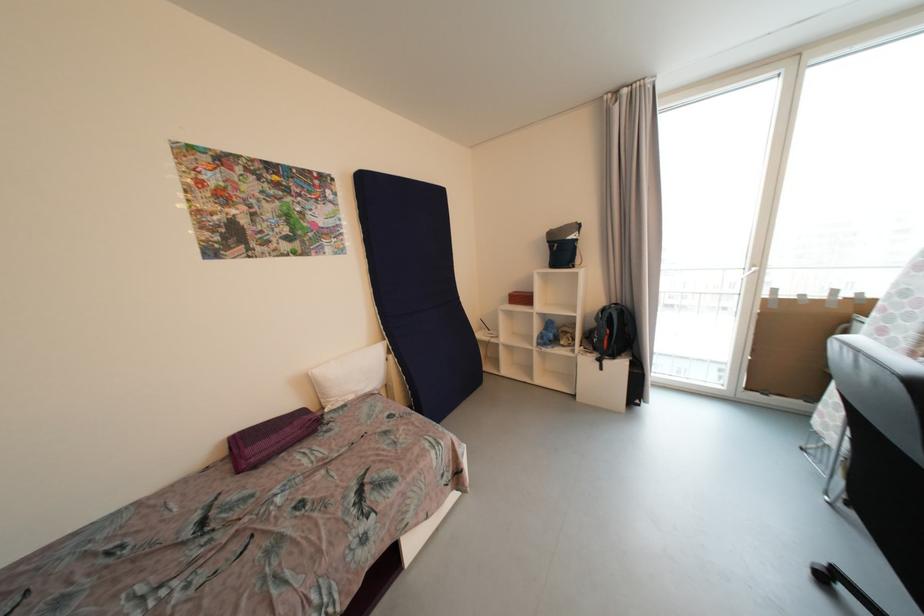
Which object does [548,334] point to?

It corresponds to the blue stuffed toy in the image.